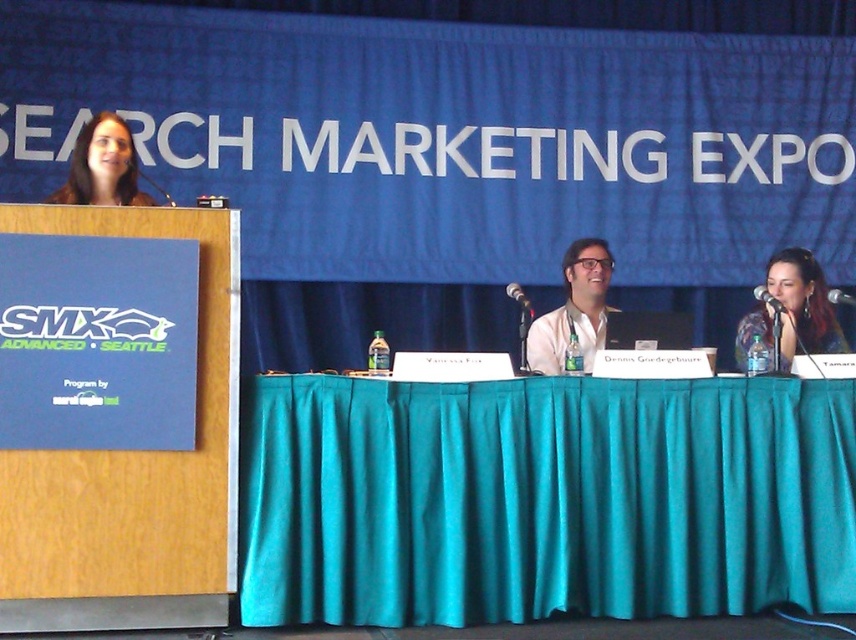
You are a speaker at the SMX Advanced Seattle event and need to reach the black plastic microphone at center. From your current position at the entrance, which is to the left of the wooden podium with the blue sign, which direction should you move to first?

The black plastic microphone at center is located at point (520,298), so you should move forward towards the center of the stage to reach it.

You are standing at the back of the SMX Advanced Seattle event hall and see two points marked in the image. Which point, point (68, 195) or point (759, 296), is closer to you?

Point (68, 195) is closer to the camera than point (759, 296).